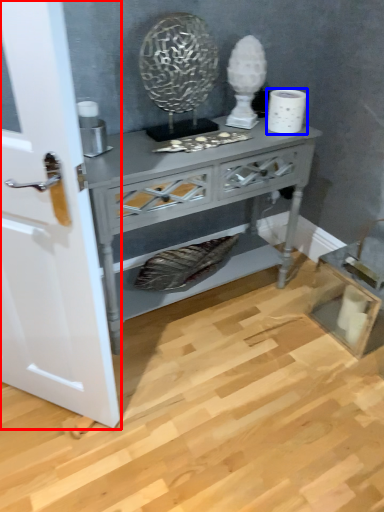
Question: Which point is closer to the camera, door (highlighted by a red box) or toilet paper (highlighted by a blue box)?

Choices:
 (A) door
 (B) toilet paper

Answer: (A)